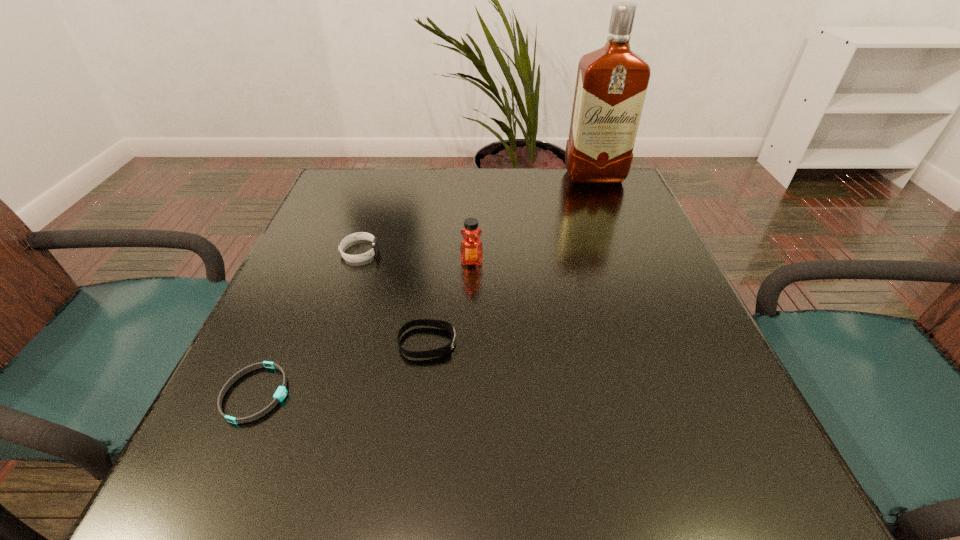
At what (x,y) coordinates should I click in order to perform the action: click on free area in between the shortest wristband and the fourth tallest object. Please return your answer as a coordinate pair (x, y). The image size is (960, 540). Looking at the image, I should click on (342, 368).

In order to click on free space between the fourth farthest object and the third shortest object in this screenshot , I will do `click(394, 298)`.

This screenshot has width=960, height=540. Find the location of `free spot between the third object from left to right and the fourth object from left to right`. free spot between the third object from left to right and the fourth object from left to right is located at coordinates (449, 302).

You are a GUI agent. You are given a task and a screenshot of the screen. Output one action in this format:
    pyautogui.click(x=<x>, y=<y>)
    Task: Click on the free space between the shortest object and the second farthest wristband
    This screenshot has width=960, height=540.
    Given the screenshot: What is the action you would take?
    pyautogui.click(x=342, y=368)

In order to click on object that is the fourth nearest to the liquor in this screenshot , I will do `click(280, 394)`.

This screenshot has height=540, width=960. In order to click on object that is the fourth closest to the third shortest object in this screenshot , I will do `click(611, 85)`.

Find the location of a particular element. The image size is (960, 540). wristband object that ranks as the third closest to the honey is located at coordinates (280, 394).

Point out which wristband is positioned as the second nearest to the shortest object. Please provide its 2D coordinates. Your answer should be formatted as a tuple, i.e. [(x, y)], where the tuple contains the x and y coordinates of a point satisfying the conditions above.

[(353, 237)]

Where is `blank space that satisfies the following two spatial constraints: 1. on the front label of the rightmost object; 2. on the outer surface of the farthest wristband`? The width and height of the screenshot is (960, 540). blank space that satisfies the following two spatial constraints: 1. on the front label of the rightmost object; 2. on the outer surface of the farthest wristband is located at coordinates (624, 253).

Find the location of `vacant region that satisfies the following two spatial constraints: 1. on the front label of the farthest object; 2. on the outer surface of the tallest wristband`. vacant region that satisfies the following two spatial constraints: 1. on the front label of the farthest object; 2. on the outer surface of the tallest wristband is located at coordinates (624, 253).